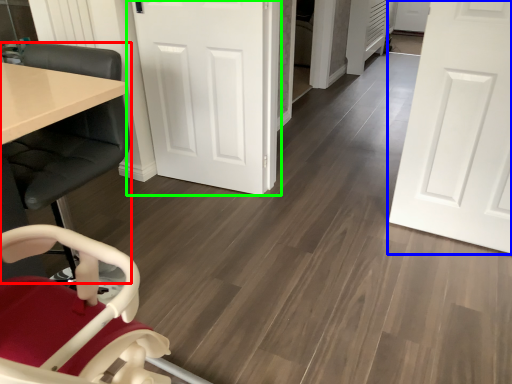
Question: Considering the real-world distances, which object is farthest from chair (highlighted by a red box)? door (highlighted by a blue box) or door (highlighted by a green box)?

Choices:
 (A) door
 (B) door

Answer: (A)